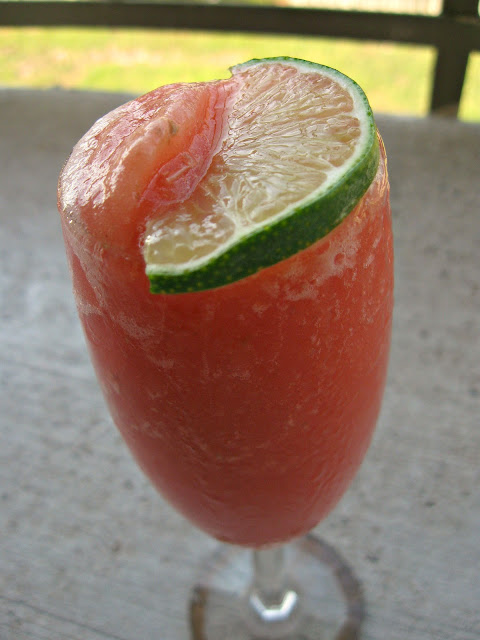
You are a GUI agent. You are given a task and a screenshot of the screen. Output one action in this format:
    pyautogui.click(x=<x>, y=<y>)
    Task: Click on the light brown table
    
    Given the screenshot: What is the action you would take?
    (x=467, y=588), (x=450, y=372), (x=27, y=362), (x=32, y=602), (x=129, y=614), (x=392, y=610), (x=443, y=169), (x=31, y=132)